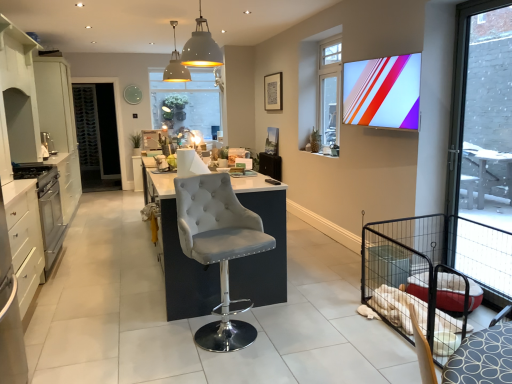
Question: From a real-world perspective, is matte white dome at center, arranged as the first light fixture when viewed from the back, positioned above or below satin silver toaster at left, the 1th appliance viewed from the top?

Choices:
 (A) below
 (B) above

Answer: (B)

Question: In terms of width, does matte white dome at center, placed as the 1th light fixture when sorted from left to right, look wider or thinner when compared to satin silver toaster at left, the third appliance in the bottom-to-top sequence?

Choices:
 (A) thin
 (B) wide

Answer: (B)

Question: Estimate the real-world distances between objects in this image. Which object is closer to the gray fabric armchair at center?

Choices:
 (A) translucent glass window at center, acting as the first window starting from the left
 (B) silver metallic oven at left, the 3th appliance when ordered from top to bottom
 (C) black mesh screen door at left
 (D) white glossy cabinet at left, marked as the 1th cabinetry in a front-to-back arrangement
 (E) matte plastic tv at upper right

Answer: (D)

Question: Based on their relative distances, which object is nearer to the satin silver toaster at left, the first appliance when ordered from back to front?

Choices:
 (A) white glossy cabinet at left, marked as the 1th cabinetry in a front-to-back arrangement
 (B) matte white dome at center, arranged as the first light fixture when viewed from the back
 (C) black mesh screen door at left
 (D) silver metallic oven at left, the 2th appliance viewed from the front
 (E) clear glass window at upper center, which appears as the 2th window when viewed from the right

Answer: (D)